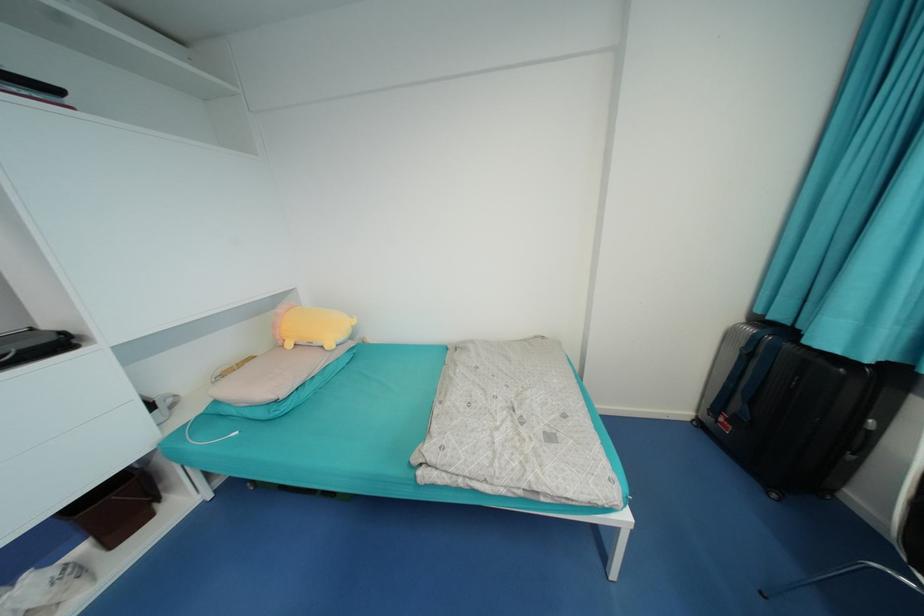
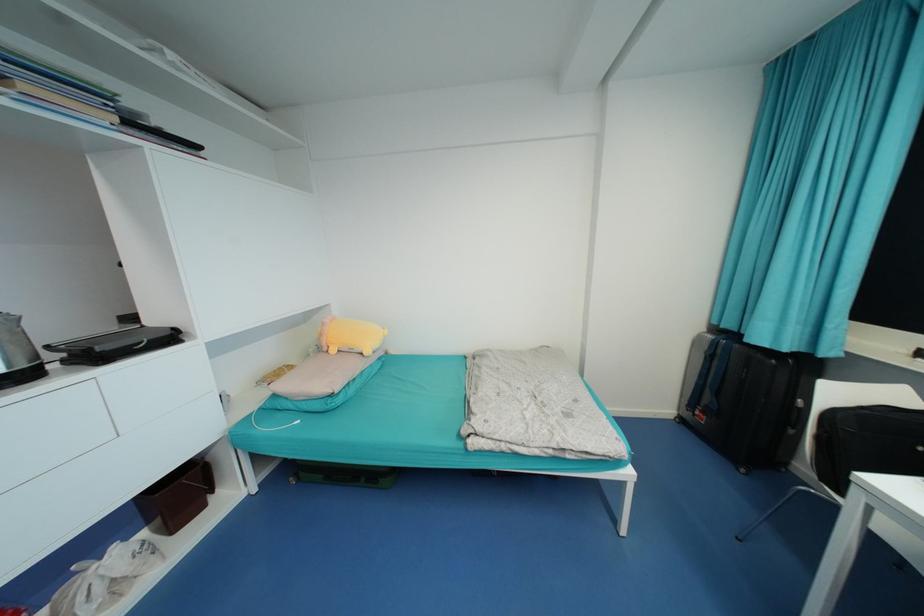
The point at (x=68, y=334) is marked in the first image. Where is the corresponding point in the second image?

(179, 330)